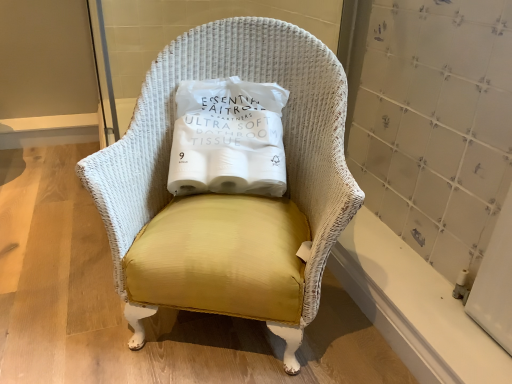
Locate an element on the screen. vacant space situated on the left part of white wicker chair at center is located at coordinates (60, 276).